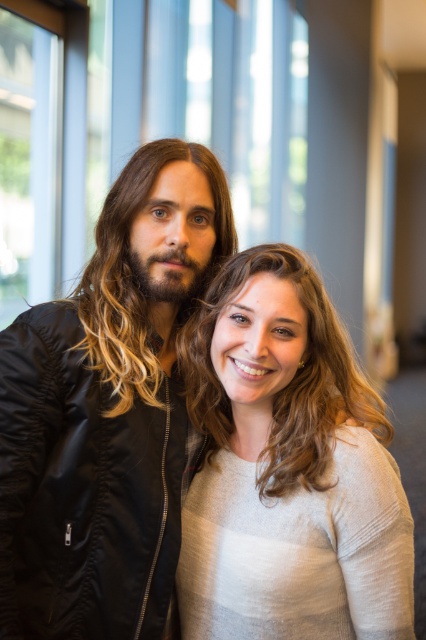
Question: Which point appears farthest from the camera in this image?

Choices:
 (A) (195, 145)
 (B) (353, 577)

Answer: (A)

Question: Is light gray sweater at center positioned at the back of brownsmoothhair at center?

Choices:
 (A) yes
 (B) no

Answer: (B)

Question: Does light gray sweater at center have a lesser width compared to brownsmoothhair at center?

Choices:
 (A) no
 (B) yes

Answer: (A)

Question: Which of the following is the closest to the observer?

Choices:
 (A) (109, 365)
 (B) (350, 413)

Answer: (A)

Question: Is light gray sweater at center to the left of brownsmoothhair at center from the viewer's perspective?

Choices:
 (A) yes
 (B) no

Answer: (B)